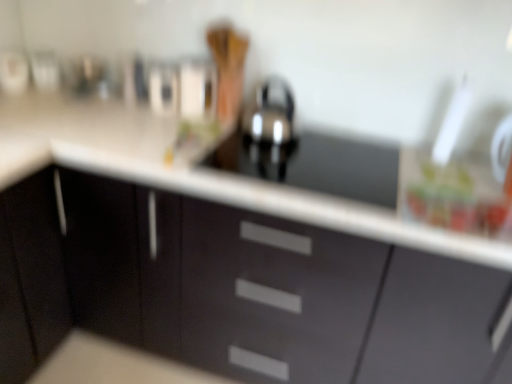
Question: In the image, is matte black cabinets at center positioned in front of or behind black glossy sink at center?

Choices:
 (A) front
 (B) behind

Answer: (A)

Question: Would you say matte black cabinets at center is inside or outside black glossy sink at center?

Choices:
 (A) inside
 (B) outside

Answer: (B)

Question: From a real-world perspective, relative to black glossy sink at center, is matte black cabinets at center vertically above or below?

Choices:
 (A) below
 (B) above

Answer: (A)

Question: Considering the relative positions of black glossy sink at center and matte black cabinets at center in the image provided, is black glossy sink at center to the left or to the right of matte black cabinets at center?

Choices:
 (A) left
 (B) right

Answer: (B)

Question: Based on their sizes in the image, would you say black glossy sink at center is bigger or smaller than matte black cabinets at center?

Choices:
 (A) big
 (B) small

Answer: (B)

Question: Considering the positions of black glossy sink at center and matte black cabinets at center in the image, is black glossy sink at center wider or thinner than matte black cabinets at center?

Choices:
 (A) wide
 (B) thin

Answer: (B)

Question: From the image's perspective, is black glossy sink at center positioned above or below matte black cabinets at center?

Choices:
 (A) below
 (B) above

Answer: (B)